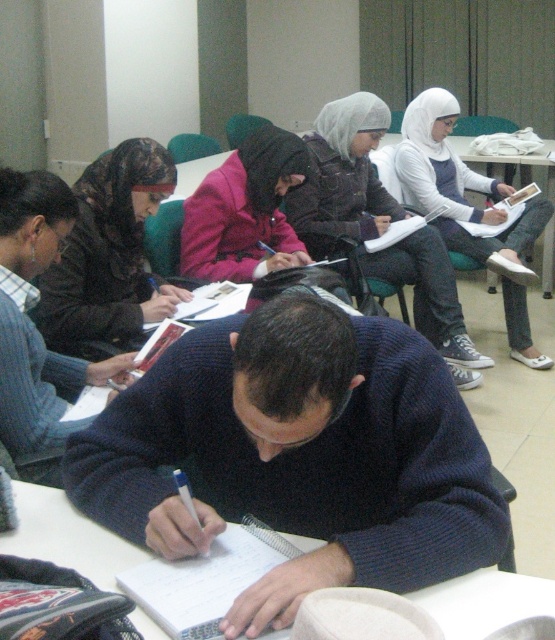
Where is the blue sweater at center located in the image?

The blue sweater at center is located at point (32, 323) in the image.

You are a student sitting at a desk in the classroom. You notice two points marked on the wall in front of you. The first point is at coordinate point (17, 252) and the second is at coordinate point (442, 221). Which point is closer to your eyes?

The point at coordinate point (17, 252) is closer to your eyes because it is closer to the camera than point (442, 221).

You are a student sitting at the table in the classroom. You notice two sweaters hanging on the back of chairs in front of you. One is a dark blue sweater at center and the other is a white knit sweater at upper center. Which sweater is closer to you?

The dark blue sweater at center is closer to the viewer than the white knit sweater at upper center.